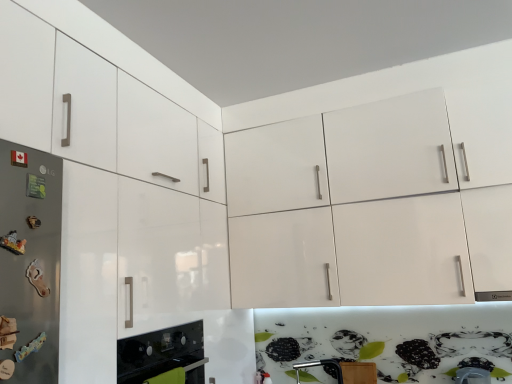
Question: Is satin silver refrigerator at left at the left side of glossy white cabinet at upper left?

Choices:
 (A) yes
 (B) no

Answer: (B)

Question: Can you confirm if satin silver refrigerator at left is thinner than glossy white cabinet at upper left?

Choices:
 (A) no
 (B) yes

Answer: (B)

Question: Is satin silver refrigerator at left aimed at glossy white cabinet at upper left?

Choices:
 (A) no
 (B) yes

Answer: (A)

Question: From the image's perspective, is satin silver refrigerator at left located beneath glossy white cabinet at upper left?

Choices:
 (A) yes
 (B) no

Answer: (B)

Question: From a real-world perspective, is satin silver refrigerator at left positioned under glossy white cabinet at upper left based on gravity?

Choices:
 (A) no
 (B) yes

Answer: (B)

Question: Considering the positions of satin silver refrigerator at left and black glass oven at lower left in the image, is satin silver refrigerator at left bigger or smaller than black glass oven at lower left?

Choices:
 (A) big
 (B) small

Answer: (B)

Question: Relative to black glass oven at lower left, is satin silver refrigerator at left in front or behind?

Choices:
 (A) front
 (B) behind

Answer: (A)

Question: Is point (53, 182) positioned closer to the camera than point (190, 337)?

Choices:
 (A) closer
 (B) farther

Answer: (A)

Question: Which is correct: satin silver refrigerator at left is inside black glass oven at lower left, or outside of it?

Choices:
 (A) inside
 (B) outside

Answer: (B)

Question: Is metallic screwdriver at lower center bigger or smaller than glossy white cabinet at upper left?

Choices:
 (A) big
 (B) small

Answer: (B)

Question: From the image's perspective, is metallic screwdriver at lower center located above or below glossy white cabinet at upper left?

Choices:
 (A) above
 (B) below

Answer: (B)

Question: Relative to glossy white cabinet at upper left, is metallic screwdriver at lower center in front or behind?

Choices:
 (A) behind
 (B) front

Answer: (A)

Question: Looking at their shapes, would you say metallic screwdriver at lower center is wider or thinner than glossy white cabinet at upper left?

Choices:
 (A) wide
 (B) thin

Answer: (B)

Question: Is point (74, 87) positioned closer to the camera than point (295, 375)?

Choices:
 (A) closer
 (B) farther

Answer: (A)

Question: Is glossy white cabinet at upper left spatially inside metallic screwdriver at lower center, or outside of it?

Choices:
 (A) inside
 (B) outside

Answer: (B)